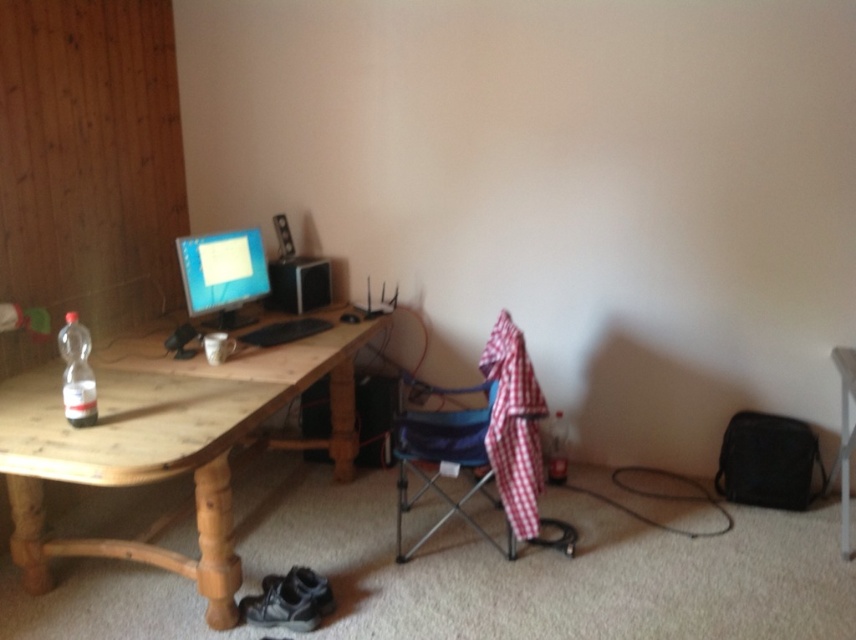
Is point (206, 470) positioned behind point (224, 326)?

No, it is not.

Consider the image. Can you confirm if wooden table at left is positioned below matte black monitor at upper left?

Yes.

Is point (260, 380) positioned behind point (199, 294)?

No, it is in front of (199, 294).

Locate an element on the screen. wooden table at left is located at coordinates (167, 442).

Is the position of wooden table at left more distant than that of clear glass bottle at lower right?

No, wooden table at left is closer to the viewer.

Between wooden table at left and clear glass bottle at lower right, which one has less height?

clear glass bottle at lower right is shorter.

The image size is (856, 640). Identify the location of wooden table at left. (167, 442).

Who is higher up, plaid fabric folding chair at center or matte black monitor at upper left?

matte black monitor at upper left

Is plaid fabric folding chair at center to the left of matte black monitor at upper left from the viewer's perspective?

No, plaid fabric folding chair at center is not to the left of matte black monitor at upper left.

Which is behind, point (470, 442) or point (244, 237)?

The point (244, 237) is behind.

Where is `plaid fabric folding chair at center`? Image resolution: width=856 pixels, height=640 pixels. plaid fabric folding chair at center is located at coordinates (480, 440).